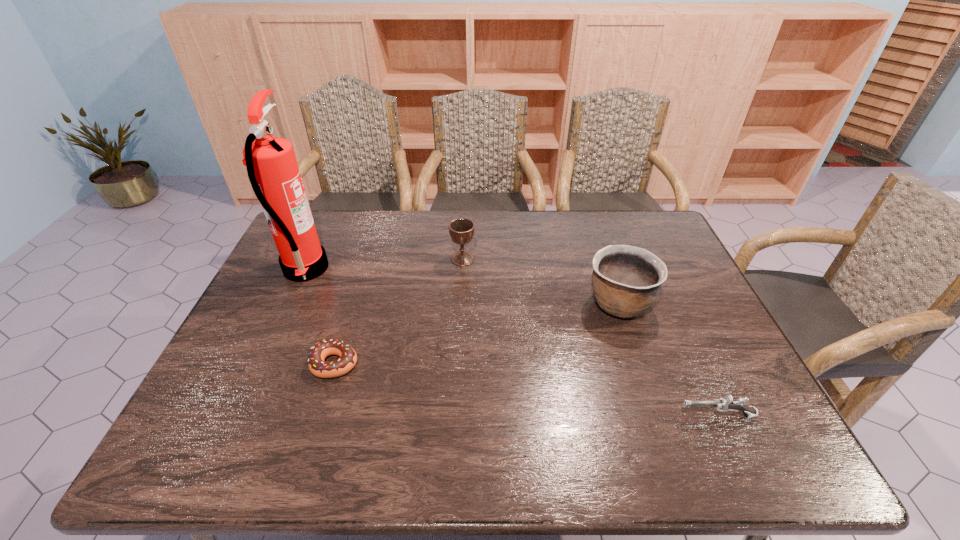
Find the location of a particular element. The height and width of the screenshot is (540, 960). empty space that is in between the doughnut and the pottery is located at coordinates (477, 333).

You are a GUI agent. You are given a task and a screenshot of the screen. Output one action in this format:
    pyautogui.click(x=<x>, y=<y>)
    Task: Click on the vacant area that lies between the third object from left to right and the pottery
    Image resolution: width=960 pixels, height=540 pixels.
    Given the screenshot: What is the action you would take?
    pyautogui.click(x=540, y=281)

Find the location of a particular element. The height and width of the screenshot is (540, 960). free space between the chalice and the second nearest object is located at coordinates (398, 311).

Find the location of a particular element. vacant space that's between the fourth tallest object and the fire extinguisher is located at coordinates (511, 342).

Identify the location of vacant space that is in between the nearest object and the leftmost object. Image resolution: width=960 pixels, height=540 pixels. (511, 342).

Locate an element on the screen. The width and height of the screenshot is (960, 540). unoccupied position between the third object from right to left and the tallest object is located at coordinates coord(384,264).

Where is `the second closest object to the leftmost object`? This screenshot has height=540, width=960. the second closest object to the leftmost object is located at coordinates (461, 230).

The width and height of the screenshot is (960, 540). I want to click on object that is the second closest one to the shortest object, so click(x=461, y=230).

The width and height of the screenshot is (960, 540). What are the coordinates of `free spot that satisfies the following two spatial constraints: 1. on the back side of the pottery; 2. with the nozzle aimed from the leftmost object` in the screenshot? It's located at (608, 269).

The height and width of the screenshot is (540, 960). Find the location of `vacant region that satisfies the following two spatial constraints: 1. on the back side of the pottery; 2. on the left side of the fourth farthest object`. vacant region that satisfies the following two spatial constraints: 1. on the back side of the pottery; 2. on the left side of the fourth farthest object is located at coordinates (353, 303).